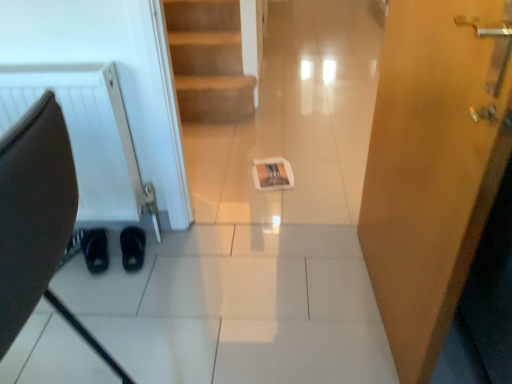
Question: Is point (387, 163) positioned closer to the camera than point (3, 264)?

Choices:
 (A) closer
 (B) farther

Answer: (B)

Question: From the image's perspective, is wooden door at right located above or below brown leather swivel chair at left?

Choices:
 (A) below
 (B) above

Answer: (B)

Question: Based on their relative distances, which object is nearer to the brown leather swivel chair at left?

Choices:
 (A) wooden door at right
 (B) black suede shoes at lower left, the first footwear positioned from the right
 (C) matte paper magazine at center
 (D) black suede shoes at lower left, the first footwear from the left
 (E) white textured radiator at left

Answer: (A)

Question: Which is nearer to the black suede shoes at lower left, the first footwear from the left?

Choices:
 (A) brown leather swivel chair at left
 (B) matte paper magazine at center
 (C) black suede shoes at lower left, which is the second footwear from left to right
 (D) white textured radiator at left
 (E) wooden door at right

Answer: (C)